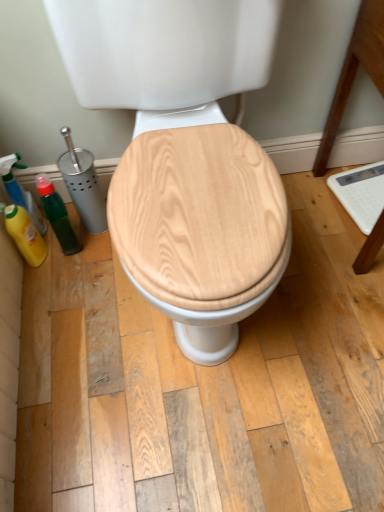
Question: Is the surface of wooden toilet seat at center in direct contact with yellow matte bottle at left, the 1th cleaning product positioned from the bottom?

Choices:
 (A) no
 (B) yes

Answer: (A)

Question: Is wooden toilet seat at center at the left side of yellow matte bottle at left, the second cleaning product when ordered from top to bottom?

Choices:
 (A) yes
 (B) no

Answer: (B)

Question: From a real-world perspective, is wooden toilet seat at center positioned under yellow matte bottle at left, the second cleaning product when ordered from top to bottom, based on gravity?

Choices:
 (A) no
 (B) yes

Answer: (A)

Question: Does wooden toilet seat at center have a greater width compared to yellow matte bottle at left, the second cleaning product when ordered from top to bottom?

Choices:
 (A) yes
 (B) no

Answer: (A)

Question: Is wooden toilet seat at center positioned in front of yellow matte bottle at left, the 1th cleaning product positioned from the bottom?

Choices:
 (A) no
 (B) yes

Answer: (B)

Question: From the image's perspective, is wooden toilet seat at center beneath yellow matte bottle at left, the second cleaning product when ordered from top to bottom?

Choices:
 (A) yes
 (B) no

Answer: (B)

Question: Is yellow matte bottle at left, the 1th cleaning product positioned from the bottom, positioned far away from green matte bottle at left?

Choices:
 (A) no
 (B) yes

Answer: (A)

Question: Is yellow matte bottle at left, the 1th cleaning product positioned from the bottom, shorter than green matte bottle at left?

Choices:
 (A) no
 (B) yes

Answer: (B)

Question: Does yellow matte bottle at left, the 1th cleaning product positioned from the bottom, appear on the left side of green matte bottle at left?

Choices:
 (A) no
 (B) yes

Answer: (B)

Question: Does yellow matte bottle at left, the 1th cleaning product positioned from the bottom, turn towards green matte bottle at left?

Choices:
 (A) yes
 (B) no

Answer: (B)

Question: Does yellow matte bottle at left, the second cleaning product when ordered from top to bottom, have a greater width compared to green matte bottle at left?

Choices:
 (A) no
 (B) yes

Answer: (A)

Question: Can you confirm if yellow matte bottle at left, the 1th cleaning product positioned from the bottom, is thinner than green matte bottle at left?

Choices:
 (A) yes
 (B) no

Answer: (A)

Question: Is green matte bottle at left looking in the opposite direction of wooden toilet seat at center?

Choices:
 (A) yes
 (B) no

Answer: (B)